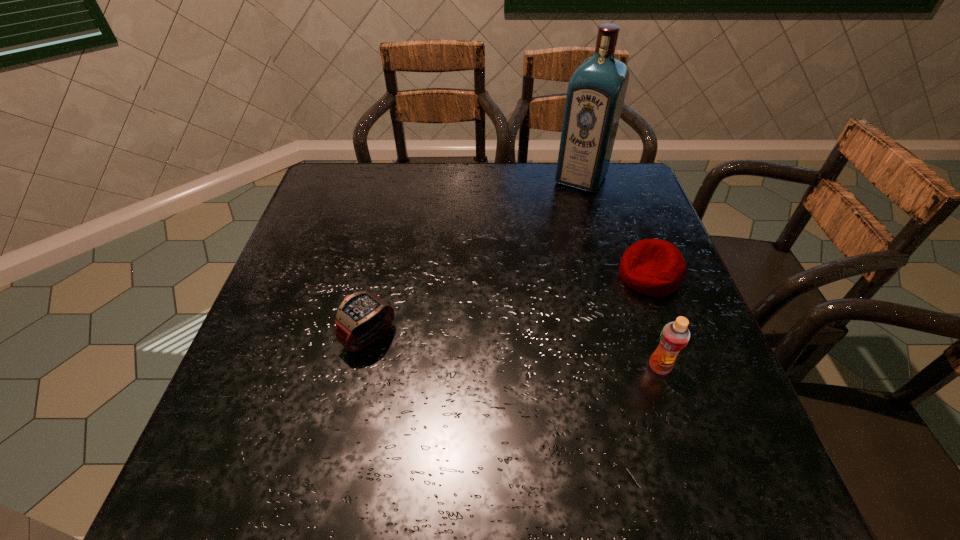
Identify the location of free space between the liquor and the watch. (475, 258).

I want to click on vacant region between the leftmost object and the orange juice, so click(x=515, y=352).

Locate an element on the screen. vacant space that's between the watch and the third shortest object is located at coordinates (515, 352).

This screenshot has height=540, width=960. I want to click on free point between the beanbag and the farthest object, so click(615, 227).

Identify which object is the nearest to the tallest object. Please provide its 2D coordinates. Your answer should be formatted as a tuple, i.e. [(x, y)], where the tuple contains the x and y coordinates of a point satisfying the conditions above.

[(653, 267)]

Locate which object is the third closest to the shortest object. Please provide its 2D coordinates. Your answer should be formatted as a tuple, i.e. [(x, y)], where the tuple contains the x and y coordinates of a point satisfying the conditions above.

[(363, 317)]

This screenshot has height=540, width=960. Identify the location of free region that satisfies the following two spatial constraints: 1. on the front side of the third nearest object; 2. on the left side of the liquor. (608, 276).

Image resolution: width=960 pixels, height=540 pixels. I want to click on blank space that satisfies the following two spatial constraints: 1. on the front side of the leftmost object; 2. on the left side of the third shortest object, so click(363, 367).

The width and height of the screenshot is (960, 540). Find the location of `vacant space that satisfies the following two spatial constraints: 1. on the front side of the farthest object; 2. on the right side of the third shortest object`. vacant space that satisfies the following two spatial constraints: 1. on the front side of the farthest object; 2. on the right side of the third shortest object is located at coordinates (x=634, y=367).